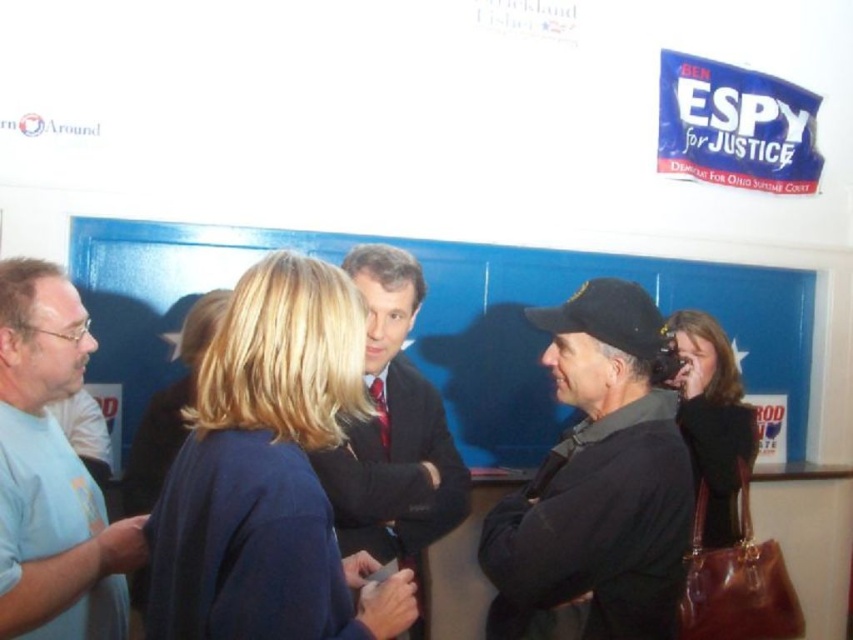
You are organizing a photo shoot and need to place a small prop that requires space between the dark blue fabric jacket at center and the dark brown leather purse at lower right. Based on their sizes, which object should you place the prop next to to ensure it has enough space?

The dark blue fabric jacket at center has a larger width than the dark brown leather purse at lower right, so placing the prop next to the dark blue fabric jacket at center would provide more space for the prop.